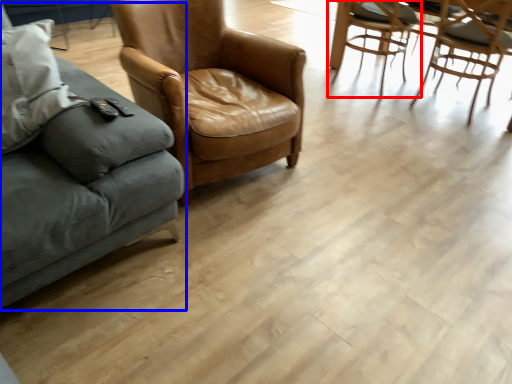
Question: Which object appears closest to the camera in this image, chair (highlighted by a red box) or studio couch (highlighted by a blue box)?

Choices:
 (A) chair
 (B) studio couch

Answer: (B)